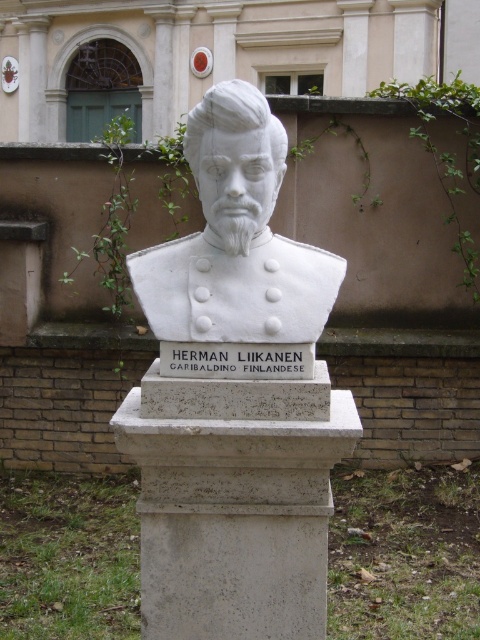
You are an art conservator assessing the placement of the white stone bust at center and the white stone sign at center. Based on their sizes, which one is more likely to require a more stable base to prevent tipping over?

The white stone bust at center has a larger size compared to the white stone sign at center, so it is more likely to require a more stable base to prevent tipping over due to its greater mass and height.

You are an art conservator assessing the dimensions of the monument. Given that the white stone sign at center must be visible from a distance, would the white stone bust at center block its view due to its size?

The white stone bust at center is wider than the white stone sign at center, so it might block the view of the sign from certain angles, depending on their placement.